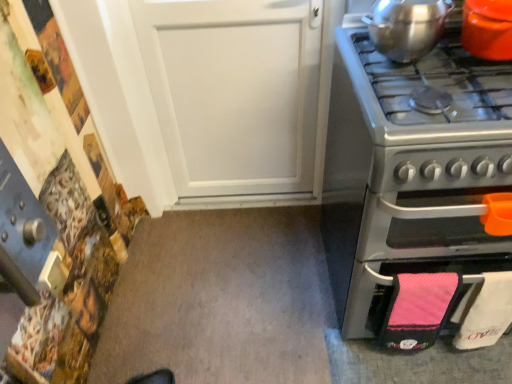
Question: Is shiny metallic pot at upper right, positioned as the 2th kitchen appliance in right-to-left order, inside the boundaries of orange glossy pot at upper right, which ranks as the second kitchen appliance in left-to-right order, or outside?

Choices:
 (A) inside
 (B) outside

Answer: (B)

Question: From the image's perspective, is shiny metallic pot at upper right, positioned as the 2th kitchen appliance in right-to-left order, positioned above or below orange glossy pot at upper right, positioned as the 1th kitchen appliance in right-to-left order?

Choices:
 (A) above
 (B) below

Answer: (A)

Question: Which object is the closest to the orange glossy pot at upper right, which ranks as the second kitchen appliance in left-to-right order?

Choices:
 (A) shiny metallic pot at upper right, the first kitchen appliance positioned from the left
 (B) stainless steel oven at right

Answer: (A)

Question: Based on their relative distances, which object is farther from the orange glossy pot at upper right, which ranks as the second kitchen appliance in left-to-right order?

Choices:
 (A) stainless steel oven at right
 (B) shiny metallic pot at upper right, positioned as the 2th kitchen appliance in right-to-left order

Answer: (A)